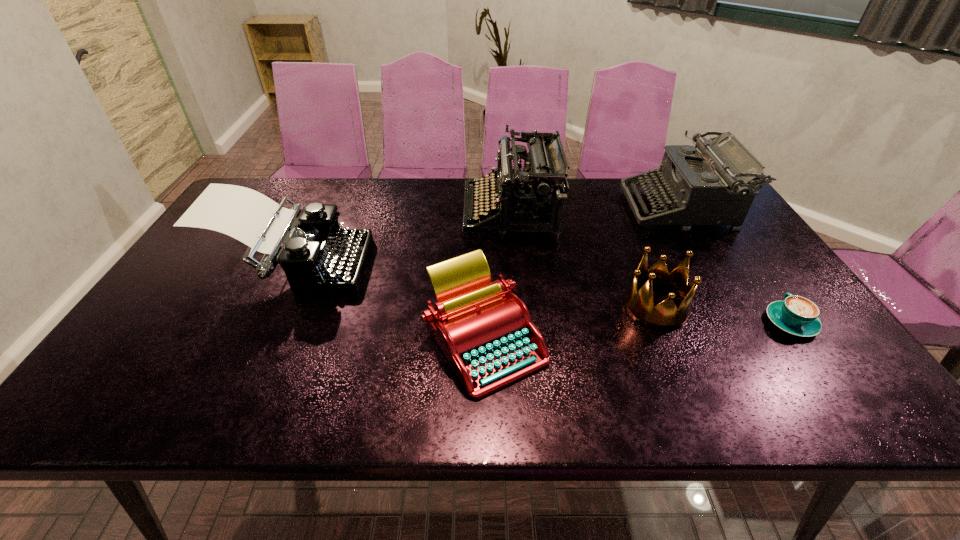
Select which object appears as the second closest to the leftmost object. Please provide its 2D coordinates. Your answer should be formatted as a tuple, i.e. [(x, y)], where the tuple contains the x and y coordinates of a point satisfying the conditions above.

[(536, 196)]

Point out which typewriter is positioned as the second nearest to the crown. Please provide its 2D coordinates. Your answer should be formatted as a tuple, i.e. [(x, y)], where the tuple contains the x and y coordinates of a point satisfying the conditions above.

[(536, 196)]

Identify which typewriter is located as the nearest to the crown. Please provide its 2D coordinates. Your answer should be formatted as a tuple, i.e. [(x, y)], where the tuple contains the x and y coordinates of a point satisfying the conditions above.

[(709, 184)]

Image resolution: width=960 pixels, height=540 pixels. In order to click on vacant space that satisfies the following two spatial constraints: 1. with the handle on the right side of the cappuccino; 2. on the typing side of the rightmost typewriter in this screenshot , I will do `click(711, 208)`.

This screenshot has width=960, height=540. Identify the location of vacant space that satisfies the following two spatial constraints: 1. on the typing side of the rightmost typewriter; 2. on the typing side of the shortest typewriter. (759, 340).

Where is `free space that satisfies the following two spatial constraints: 1. with the handle on the right side of the shortest object; 2. on the keys of the leftmost object`? This screenshot has width=960, height=540. free space that satisfies the following two spatial constraints: 1. with the handle on the right side of the shortest object; 2. on the keys of the leftmost object is located at coordinates (752, 266).

This screenshot has height=540, width=960. I want to click on vacant space that satisfies the following two spatial constraints: 1. with the handle on the right side of the shortest object; 2. on the typing side of the rightmost typewriter, so click(711, 208).